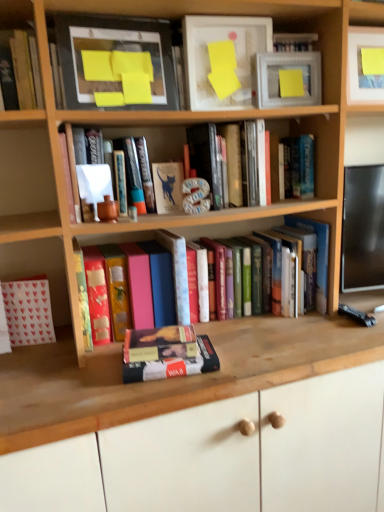
Find the location of a particular element. vacant area that lies in front of hardcover book at center, which is the 4th book in left-to-right order is located at coordinates (157, 392).